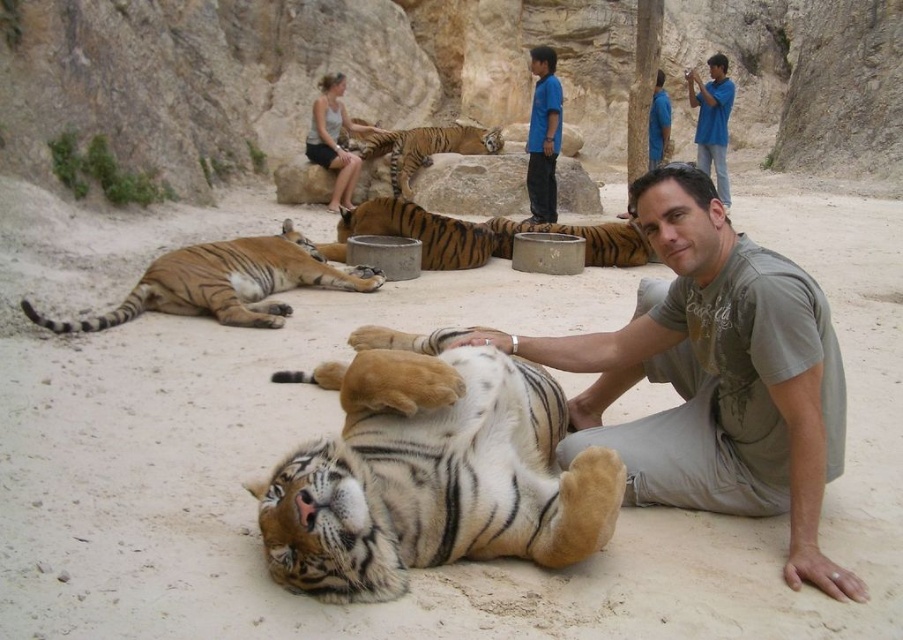
Where is `white-striped fur tiger at center`? The height and width of the screenshot is (640, 903). white-striped fur tiger at center is located at coordinates (430, 472).

Locate an element on the screen. white-striped fur tiger at center is located at coordinates (430, 472).

You are a GUI agent. You are given a task and a screenshot of the screen. Output one action in this format:
    pyautogui.click(x=<x>, y=<y>)
    Task: Click on the white-striped fur tiger at center
    This screenshot has width=903, height=640.
    Given the screenshot: What is the action you would take?
    pyautogui.click(x=430, y=472)

Does matte gray t-shirt at center have a greater width compared to blue cotton shirt at upper center?

In fact, matte gray t-shirt at center might be narrower than blue cotton shirt at upper center.

Between point (779, 364) and point (547, 115), which one is positioned behind?

The point (547, 115) is behind.

Which is behind, point (582, 397) or point (529, 164)?

Positioned behind is point (529, 164).

The width and height of the screenshot is (903, 640). Identify the location of matte gray t-shirt at center. (715, 376).

Is matte gray t-shirt at center closer to the viewer compared to blue cotton shirt at upper right?

Yes, matte gray t-shirt at center is in front of blue cotton shirt at upper right.

From the picture: Does matte gray t-shirt at center have a lesser height compared to blue cotton shirt at upper right?

Yes.

The width and height of the screenshot is (903, 640). Identify the location of matte gray t-shirt at center. (715, 376).